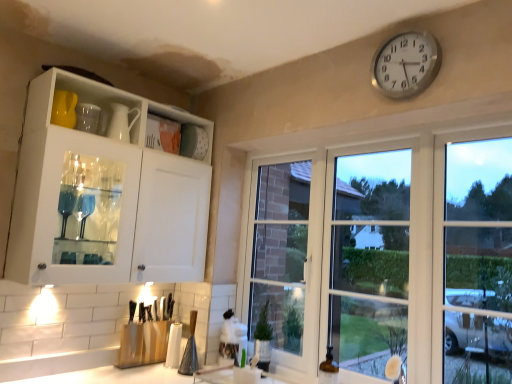
Question: Is clear glass windows at center positioned in front of white glossy cabinet at upper left?

Choices:
 (A) no
 (B) yes

Answer: (B)

Question: Is clear glass windows at center oriented towards white glossy cabinet at upper left?

Choices:
 (A) yes
 (B) no

Answer: (A)

Question: From a real-world perspective, does clear glass windows at center stand above white glossy cabinet at upper left?

Choices:
 (A) yes
 (B) no

Answer: (B)

Question: Does clear glass windows at center appear on the right side of white glossy cabinet at upper left?

Choices:
 (A) yes
 (B) no

Answer: (A)

Question: Does clear glass windows at center have a lesser height compared to white glossy cabinet at upper left?

Choices:
 (A) no
 (B) yes

Answer: (A)

Question: From a real-world perspective, is silver metallic clock at upper right physically located above or below clear glass windows at center?

Choices:
 (A) above
 (B) below

Answer: (A)

Question: Is silver metallic clock at upper right to the left or to the right of clear glass windows at center in the image?

Choices:
 (A) left
 (B) right

Answer: (B)

Question: From the image's perspective, is silver metallic clock at upper right positioned above or below clear glass windows at center?

Choices:
 (A) above
 (B) below

Answer: (A)

Question: Relative to clear glass windows at center, is silver metallic clock at upper right in front or behind?

Choices:
 (A) front
 (B) behind

Answer: (B)

Question: Considering the positions of silver metallic clock at upper right and white glossy cabinet at upper left in the image, is silver metallic clock at upper right bigger or smaller than white glossy cabinet at upper left?

Choices:
 (A) big
 (B) small

Answer: (B)

Question: From a real-world perspective, is silver metallic clock at upper right above or below white glossy cabinet at upper left?

Choices:
 (A) above
 (B) below

Answer: (A)

Question: In terms of height, does silver metallic clock at upper right look taller or shorter compared to white glossy cabinet at upper left?

Choices:
 (A) short
 (B) tall

Answer: (A)

Question: Is silver metallic clock at upper right to the left or to the right of white glossy cabinet at upper left in the image?

Choices:
 (A) right
 (B) left

Answer: (A)

Question: Based on their positions, is clear glass windows at center located to the left or right of white glossy cabinet at upper left?

Choices:
 (A) right
 (B) left

Answer: (A)

Question: In the image, is clear glass windows at center positioned in front of or behind white glossy cabinet at upper left?

Choices:
 (A) front
 (B) behind

Answer: (A)